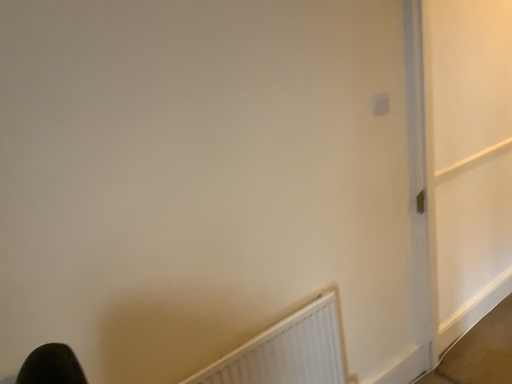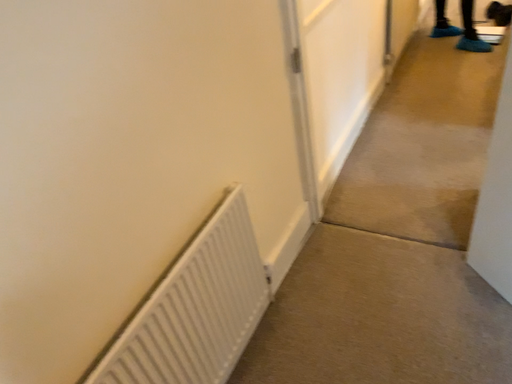
Question: How did the camera likely rotate when shooting the video?

Choices:
 (A) rotated downward
 (B) rotated upward

Answer: (A)